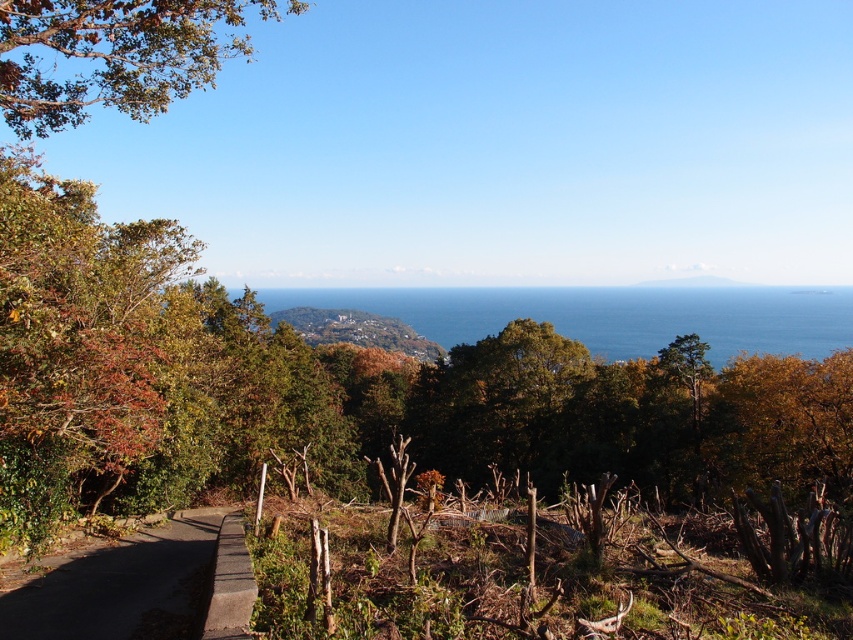
Can you confirm if gray concrete path at lower left is positioned to the right of concrete path at lower left?

No, gray concrete path at lower left is not to the right of concrete path at lower left.

Between gray concrete path at lower left and concrete path at lower left, which one is positioned lower?

gray concrete path at lower left

The width and height of the screenshot is (853, 640). What do you see at coordinates (143, 586) in the screenshot?
I see `gray concrete path at lower left` at bounding box center [143, 586].

Find the location of a particular element. The height and width of the screenshot is (640, 853). gray concrete path at lower left is located at coordinates (143, 586).

Does blue water at center appear on the right side of green grassy hillside at center?

Indeed, blue water at center is positioned on the right side of green grassy hillside at center.

Which of these two, blue water at center or green grassy hillside at center, stands shorter?

green grassy hillside at center is shorter.

You are a GUI agent. You are given a task and a screenshot of the screen. Output one action in this format:
    pyautogui.click(x=<x>, y=<y>)
    Task: Click on the blue water at center
    Image resolution: width=853 pixels, height=640 pixels.
    Given the screenshot: What is the action you would take?
    pyautogui.click(x=611, y=314)

Between blue water at center and gray concrete path at lower left, which one appears on the right side from the viewer's perspective?

From the viewer's perspective, blue water at center appears more on the right side.

At what (x,y) coordinates should I click in order to perform the action: click on blue water at center. Please return your answer as a coordinate pair (x, y). Looking at the image, I should click on (611, 314).